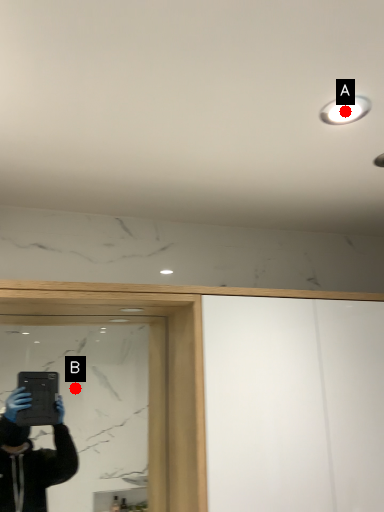
Question: Two points are circled on the image, labeled by A and B beside each circle. Which point is closer to the camera?

Choices:
 (A) A is closer
 (B) B is closer

Answer: (A)